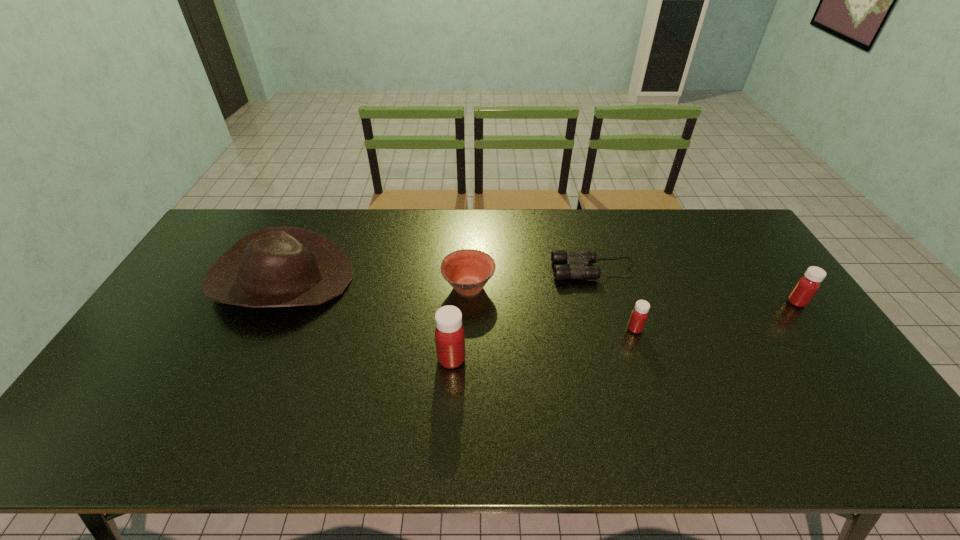
Locate an element on the screen. free space between the nearest object and the shortest object is located at coordinates (523, 314).

At what (x,y) coordinates should I click in order to perform the action: click on free space between the farthest medicine and the bowl. Please return your answer as a coordinate pair (x, y). Looking at the image, I should click on (633, 294).

You are a GUI agent. You are given a task and a screenshot of the screen. Output one action in this format:
    pyautogui.click(x=<x>, y=<y>)
    Task: Click on the free space between the rightmost object and the binoculars
    The height and width of the screenshot is (540, 960).
    Given the screenshot: What is the action you would take?
    pyautogui.click(x=696, y=286)

I want to click on free spot between the binoculars and the second tallest medicine, so click(x=696, y=286).

This screenshot has height=540, width=960. Find the location of `free spot between the bowl and the leftmost object`. free spot between the bowl and the leftmost object is located at coordinates (375, 283).

The image size is (960, 540). Identify the location of free spot between the shortest object and the second farthest medicine. (614, 299).

Identify which object is the nearest to the nearest object. Please provide its 2D coordinates. Your answer should be formatted as a tuple, i.e. [(x, y)], where the tuple contains the x and y coordinates of a point satisfying the conditions above.

[(467, 271)]

The width and height of the screenshot is (960, 540). Find the location of `the closest object to the second shortest medicine`. the closest object to the second shortest medicine is located at coordinates (577, 262).

Image resolution: width=960 pixels, height=540 pixels. Identify the location of the second closest medicine relative to the nearest object. (806, 287).

Image resolution: width=960 pixels, height=540 pixels. Find the location of `medicine that is the closest to the second nearest medicine`. medicine that is the closest to the second nearest medicine is located at coordinates (449, 334).